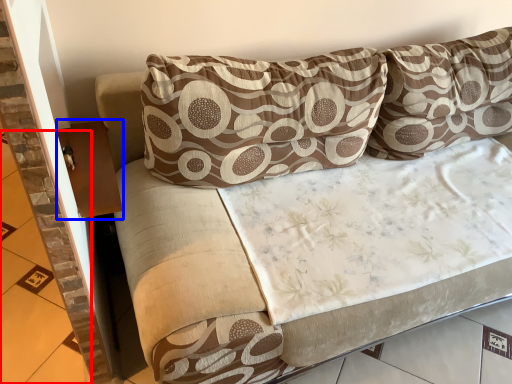
Question: Which object appears farthest to the camera in this image, tile (highlighted by a red box) or table (highlighted by a blue box)?

Choices:
 (A) tile
 (B) table

Answer: (A)